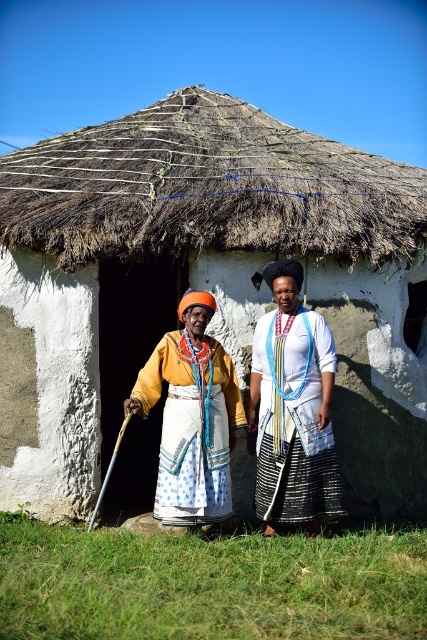
You are a traveler approaching the white stucco hut at center and the matte yellow fabric dress at center. Which object is positioned lower in the image?

The white stucco hut at center is located below the matte yellow fabric dress at center, so it is positioned lower in the image.

You are standing at the entrance of the thatched roof hut and want to move towards the point labeled as point (184,141). However, there is an obstacle at point (275,316). Will you be able to reach your destination without going around the obstacle?

Since point (184,141) is behind point (275,316), you will need to go around the obstacle at point (275,316) to reach your destination.